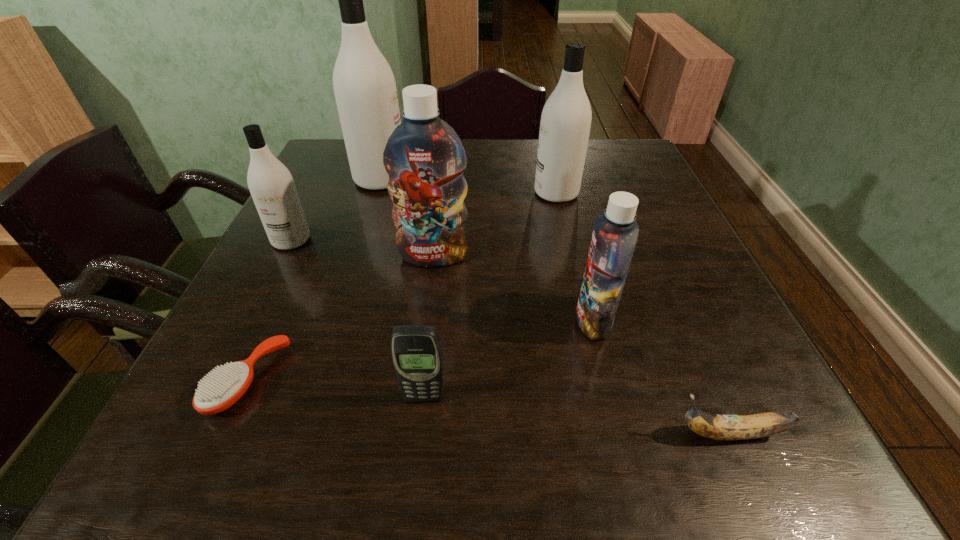
Find the location of a particular element. gray cellular telephone is located at coordinates (416, 351).

I want to click on the rightmost object, so click(x=717, y=427).

Find the location of a particular element. This screenshot has width=960, height=540. the seventh tallest object is located at coordinates (717, 427).

The width and height of the screenshot is (960, 540). What are the coordinates of `the shortest object` in the screenshot? It's located at (217, 392).

Where is `orange hairbrush`? This screenshot has width=960, height=540. orange hairbrush is located at coordinates (217, 392).

Locate an element on the screen. vacant space situated on the front-facing side of the second shampoo from left to right is located at coordinates (485, 179).

At what (x,y) coordinates should I click in order to perform the action: click on free space located 0.150m on the front-facing side of the second smallest white shampoo. Please return your answer as a coordinate pair (x, y). Looking at the image, I should click on (476, 193).

At what (x,y) coordinates should I click in order to perform the action: click on vacant space located on the front-facing side of the second smallest white shampoo. Please return your answer as a coordinate pair (x, y). Looking at the image, I should click on (443, 193).

Where is `free spot located 0.210m on the front-facing side of the second smallest white shampoo`? The height and width of the screenshot is (540, 960). free spot located 0.210m on the front-facing side of the second smallest white shampoo is located at coordinates (453, 193).

Find the location of a particular element. Image resolution: width=960 pixels, height=540 pixels. vacant space located on the front label of the farther blue shampoo is located at coordinates (411, 451).